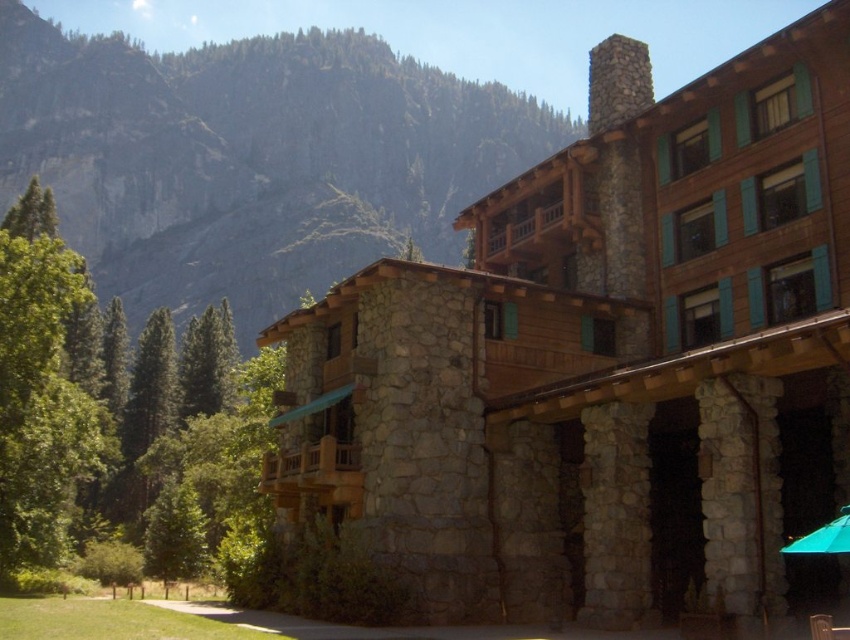
Is point (196, 488) in front of point (805, 534)?

No, it is not.

Which is in front, point (146, 346) or point (848, 524)?

Point (848, 524) is more forward.

You are a GUI agent. You are given a task and a screenshot of the screen. Output one action in this format:
    pyautogui.click(x=<x>, y=<y>)
    Task: Click on the green leafy tree at left
    
    Given the screenshot: What is the action you would take?
    (x=131, y=442)

Does rocky cliff at upper left have a lesser width compared to green leafy tree at left?

No, rocky cliff at upper left is not thinner than green leafy tree at left.

Can you confirm if rocky cliff at upper left is positioned above green leafy tree at left?

Yes.

Is point (216, 163) in front of point (46, 273)?

No, it is not.

The image size is (850, 640). I want to click on rocky cliff at upper left, so click(250, 157).

Can you confirm if green leafy tree at left is positioned below wooden chair at lower right?

No.

Can you confirm if green leafy tree at left is positioned to the left of wooden chair at lower right?

Yes, green leafy tree at left is to the left of wooden chair at lower right.

Is point (217, 326) positioned in front of point (819, 627)?

No, it is not.

This screenshot has height=640, width=850. Identify the location of green leafy tree at left. (131, 442).